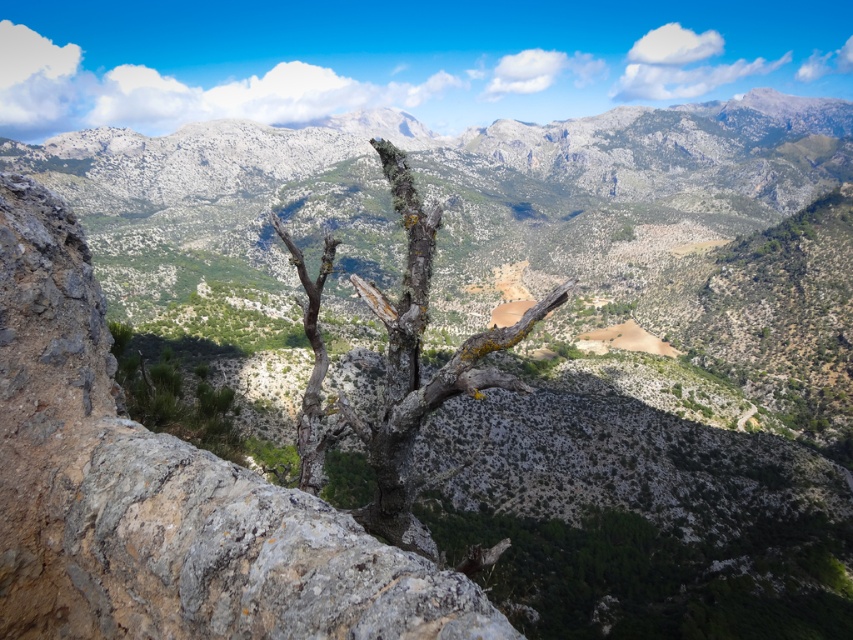
You are a photographer standing at the edge of the rocky outcrop in the foreground of this mountain landscape. You want to capture two specific points in your photo, labeled as point 1 at coordinates point (509, 234) and point 2 at coordinates point (538, 310). Based on their positions, which point is closer to your camera lens?

Point (509, 234) is further to the camera than point (538, 310), so point (538, 310) is closer to the camera lens.

You are standing at the edge of the valley looking at the gray rough rock at center and the gray rough bark tree at center. Which object is nearer to you?

The gray rough rock at center is closer to the viewer than the gray rough bark tree at center.